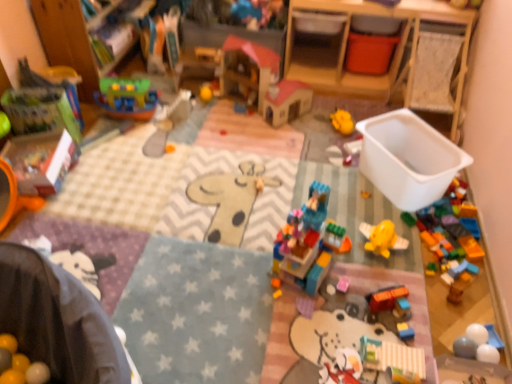
You are a GUI agent. You are given a task and a screenshot of the screen. Output one action in this format:
    pyautogui.click(x=<x>, y=<y>)
    Task: Click on the vacant space positioned to the left of yellow rubber duck at center, acting as the 6th toy starting from the top
    This screenshot has height=384, width=512.
    Given the screenshot: What is the action you would take?
    pyautogui.click(x=311, y=129)